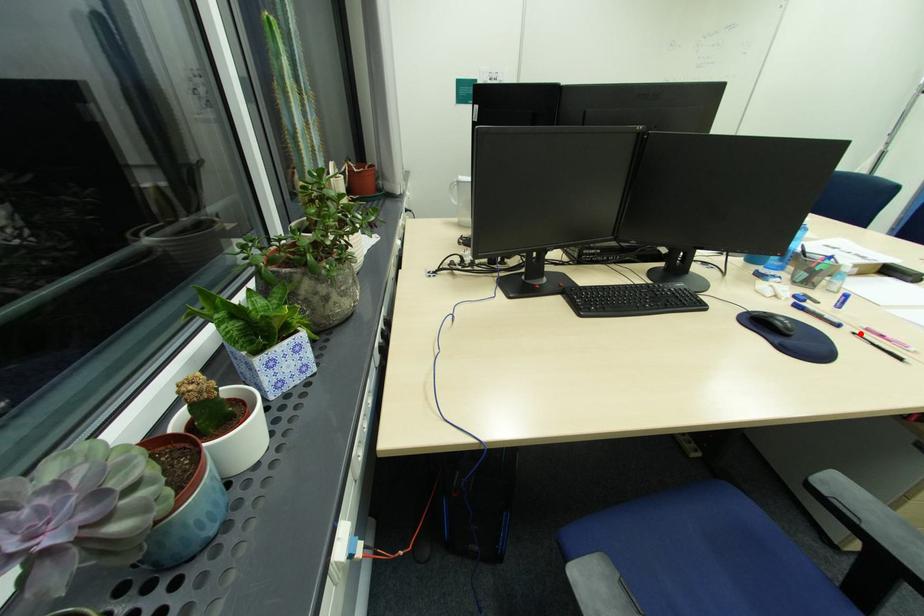
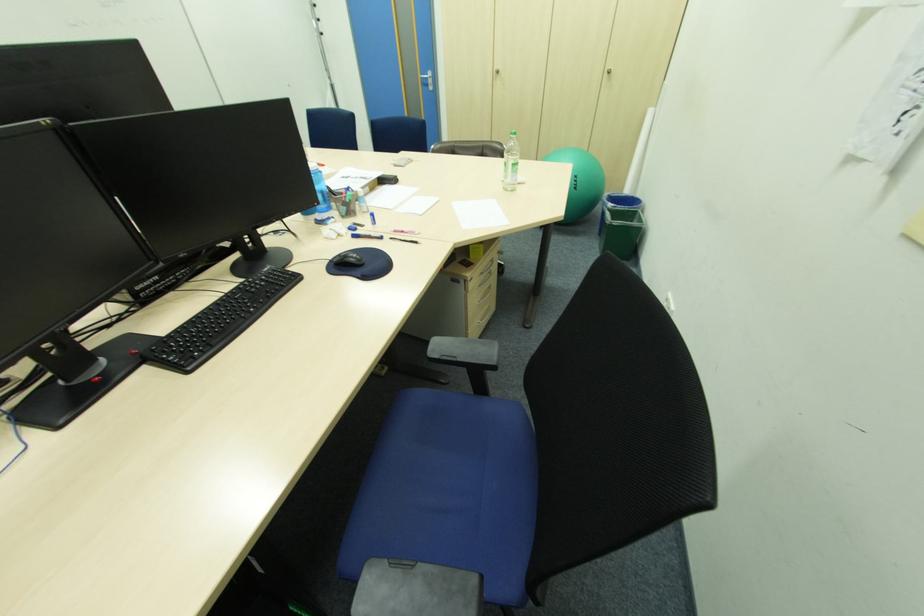
The point at the highlighted location is marked in the first image. Where is the corresponding point in the second image?

(396, 238)